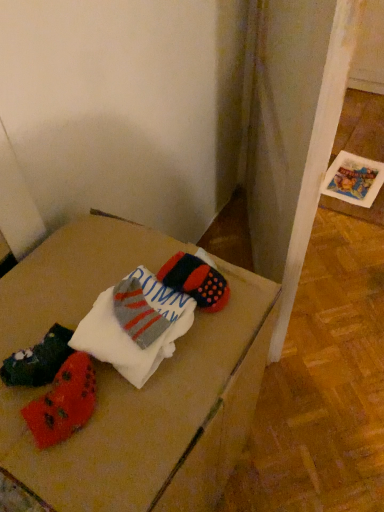
Question: From the image's perspective, would you say wooden table at center is shown under white cotton socks at center?

Choices:
 (A) yes
 (B) no

Answer: (A)

Question: Does wooden table at center have a lesser height compared to white cotton socks at center?

Choices:
 (A) no
 (B) yes

Answer: (A)

Question: Is the surface of wooden table at center in direct contact with white cotton socks at center?

Choices:
 (A) yes
 (B) no

Answer: (B)

Question: From a real-world perspective, is wooden table at center on top of white cotton socks at center?

Choices:
 (A) yes
 (B) no

Answer: (B)

Question: Considering the relative positions of wooden table at center and white cotton socks at center in the image provided, is wooden table at center to the left of white cotton socks at center from the viewer's perspective?

Choices:
 (A) no
 (B) yes

Answer: (B)

Question: Considering the relative positions of wooden table at center and white cotton socks at center in the image provided, is wooden table at center to the right of white cotton socks at center from the viewer's perspective?

Choices:
 (A) yes
 (B) no

Answer: (B)

Question: From the image's perspective, would you say white cotton socks at center is shown under wooden table at center?

Choices:
 (A) no
 (B) yes

Answer: (A)

Question: Could you tell me if white cotton socks at center is turned towards wooden table at center?

Choices:
 (A) no
 (B) yes

Answer: (A)

Question: Considering the relative sizes of white cotton socks at center and wooden table at center in the image provided, is white cotton socks at center thinner than wooden table at center?

Choices:
 (A) yes
 (B) no

Answer: (A)

Question: Does white cotton socks at center come behind wooden table at center?

Choices:
 (A) yes
 (B) no

Answer: (A)

Question: Considering the relative sizes of white cotton socks at center and wooden table at center in the image provided, is white cotton socks at center wider than wooden table at center?

Choices:
 (A) no
 (B) yes

Answer: (A)

Question: Does white cotton socks at center have a larger size compared to wooden table at center?

Choices:
 (A) yes
 (B) no

Answer: (B)

Question: From a real-world perspective, is white cotton socks at center physically located above or below wooden table at center?

Choices:
 (A) below
 (B) above

Answer: (B)